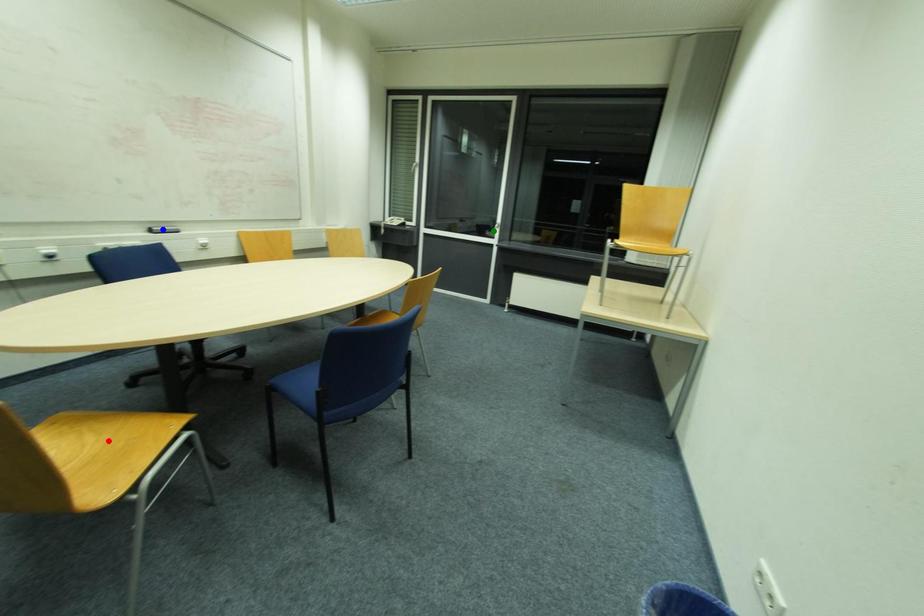
Order these from nearest to farthest:
- green point
- blue point
- red point

red point → blue point → green point